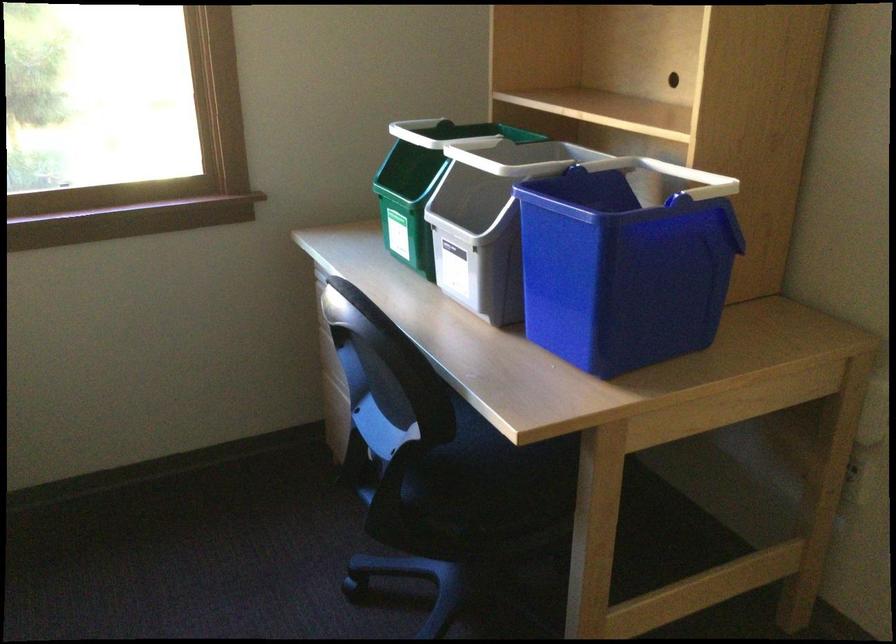
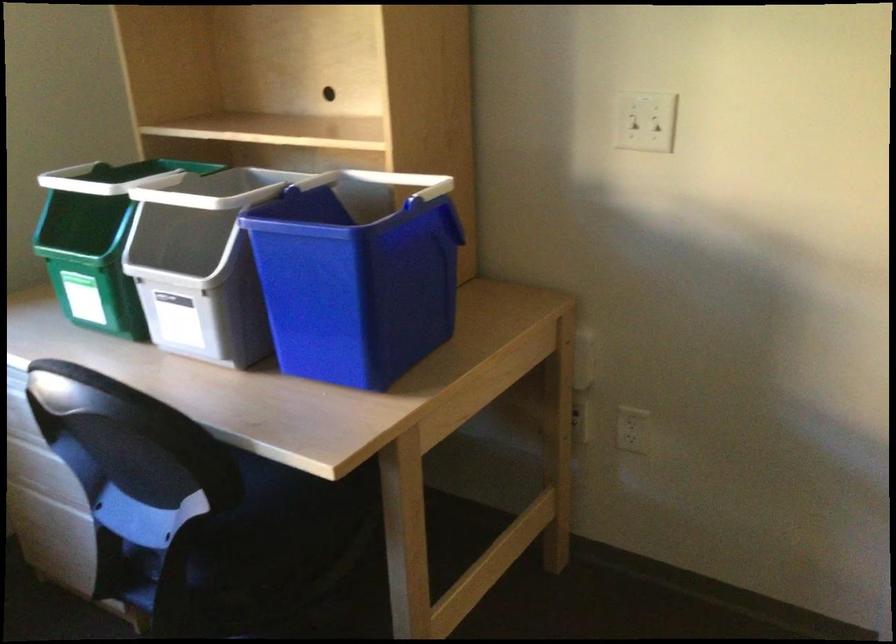
Locate, in the second image, the point that corresponds to the point at 452,134 in the first image.

(116, 178)